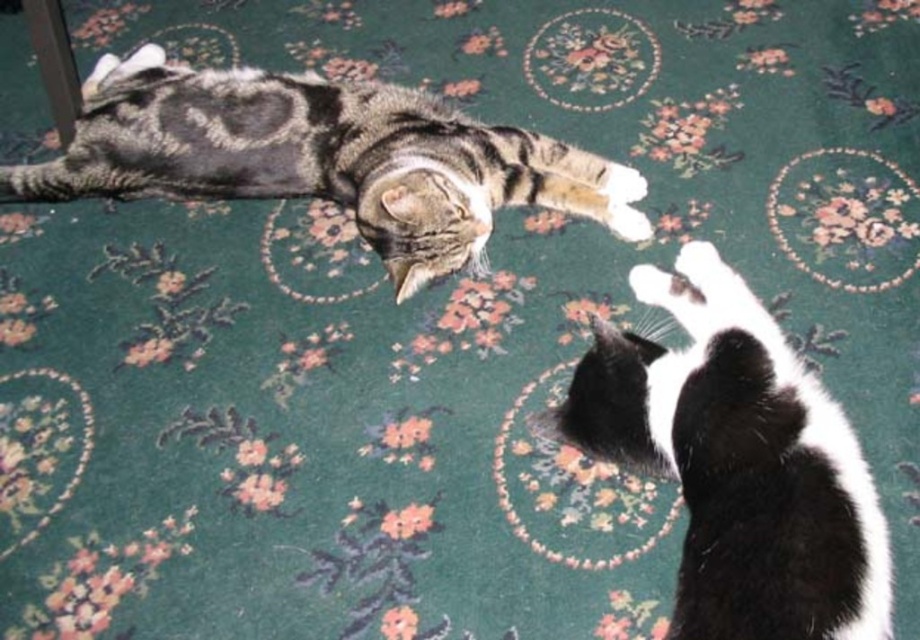
You are a cat owner who wants to place a small toy between the black and white fur at lower right and the tabby fur cat at upper left. Which cat requires more space to accommodate the toy placement?

The tabby fur cat at upper left requires more space because it is larger than the black and white fur at lower right.